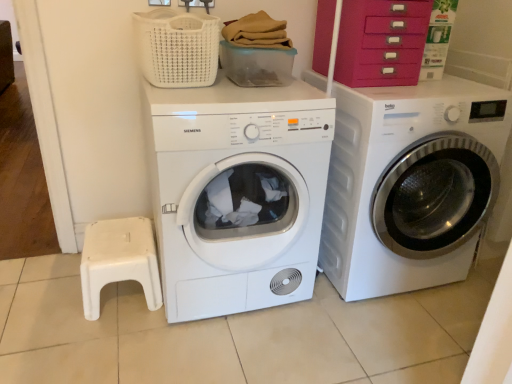
I want to click on free point below white plastic step stool at lower left (from a real-world perspective), so click(x=121, y=296).